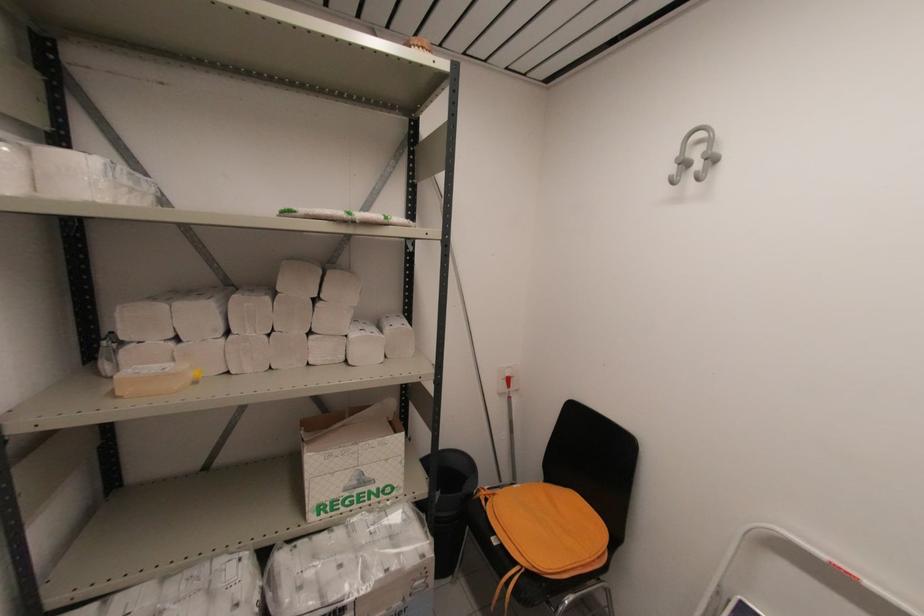
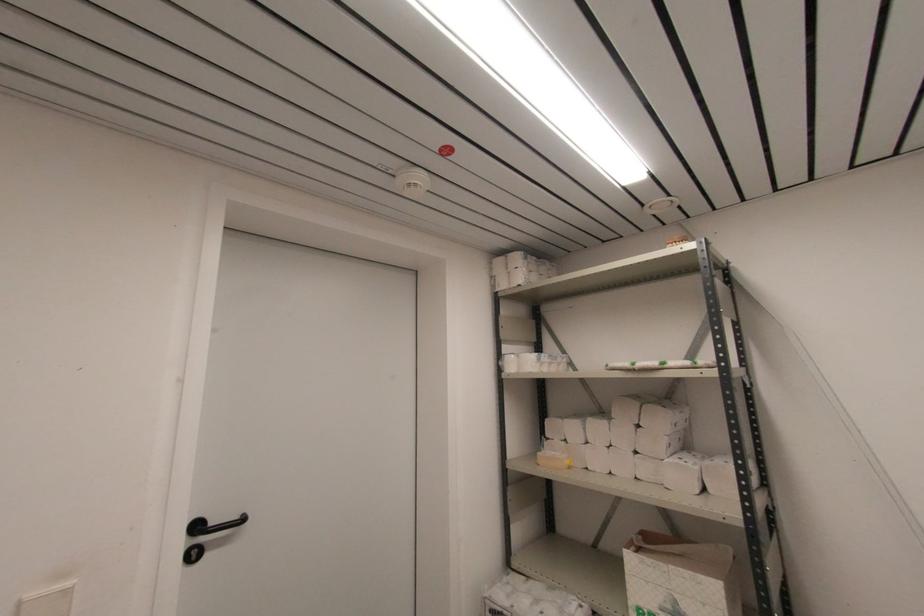
Where in the second image is the point corresponding to [123,338] from the first image?

(548, 436)